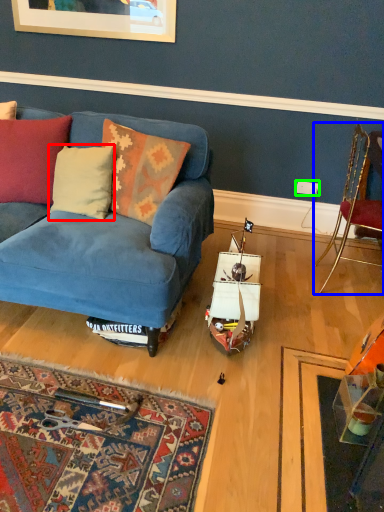
Question: Based on their relative distances, which object is nearer to pillow (highlighted by a red box)? Choose from chair (highlighted by a blue box) and power outlet (highlighted by a green box).

Choices:
 (A) chair
 (B) power outlet

Answer: (A)